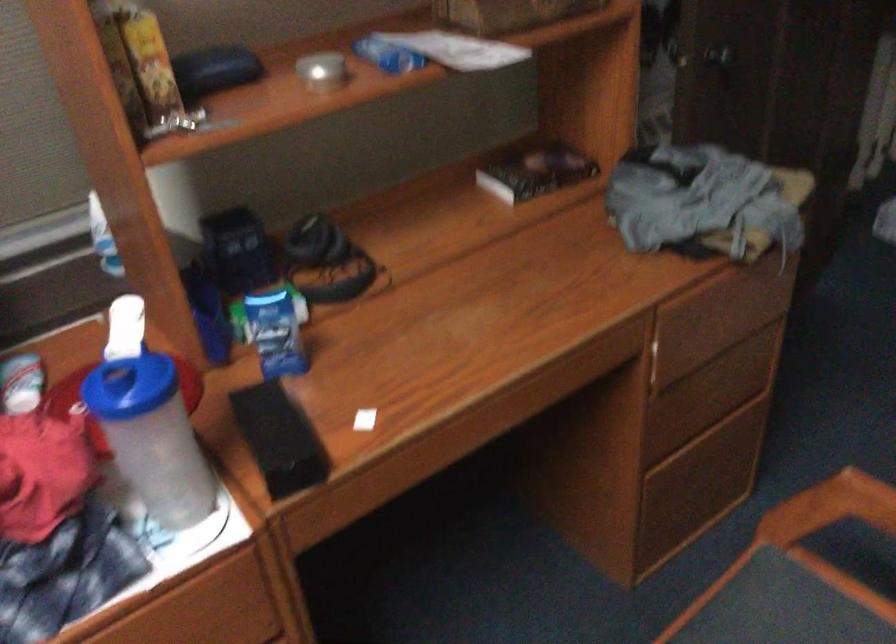
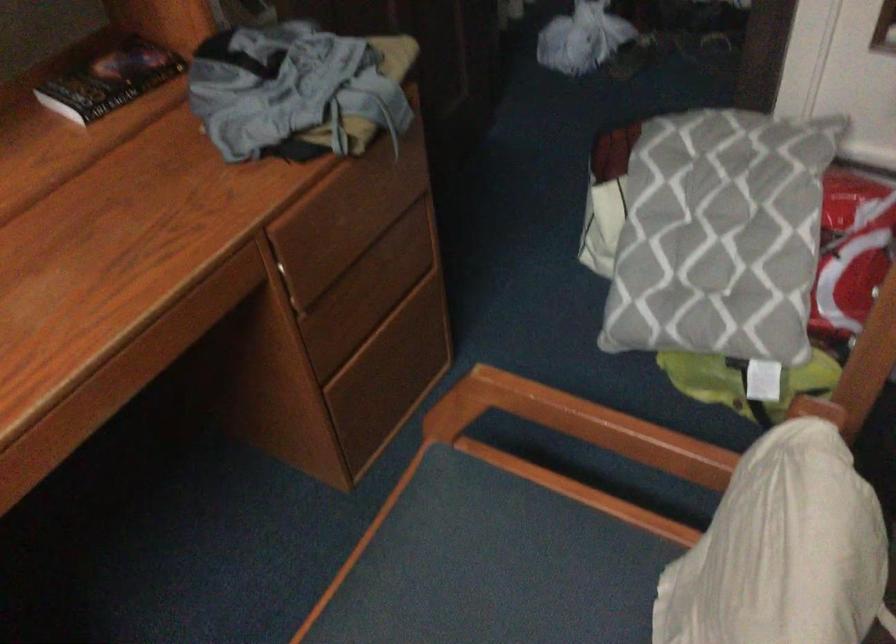
The point at (536, 169) is marked in the first image. Where is the corresponding point in the second image?

(110, 80)